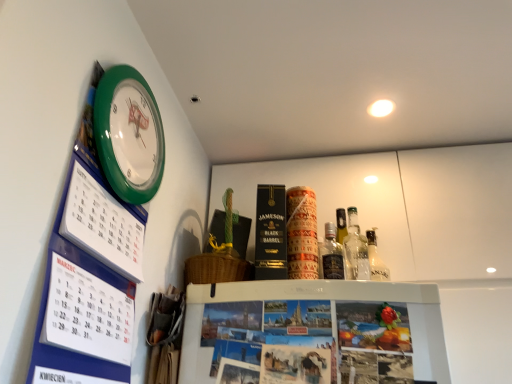
This screenshot has height=384, width=512. Describe the element at coordinates (88, 273) in the screenshot. I see `blue cardboard calendar at upper left` at that location.

In order to click on green plastic wall clock at upper left in this screenshot , I will do `click(129, 134)`.

Image resolution: width=512 pixels, height=384 pixels. I want to click on translucent glass bottle at upper right, so click(331, 255).

Between point (134, 200) and point (320, 272), which one is positioned behind?

The point (320, 272) is farther.

Considering the sizes of objects green plastic wall clock at upper left and translucent glass bottle at upper right in the image provided, who is smaller, green plastic wall clock at upper left or translucent glass bottle at upper right?

Smaller between the two is translucent glass bottle at upper right.

Does green plastic wall clock at upper left have a greater height compared to translucent glass bottle at upper right?

Indeed, green plastic wall clock at upper left has a greater height compared to translucent glass bottle at upper right.

Is green plastic wall clock at upper left in contact with translucent glass bottle at upper right?

No, green plastic wall clock at upper left is not making contact with translucent glass bottle at upper right.

Does point (336, 265) lie in front of point (119, 238)?

No.

Is translucent glass bottle at upper right not close to blue cardboard calendar at upper left?

Actually, translucent glass bottle at upper right and blue cardboard calendar at upper left are a little close together.

Locate an element on the screen. bulletin board that appears on the left of translucent glass bottle at upper right is located at coordinates (88, 273).

Considering the sizes of objects translucent glass bottle at upper right and blue cardboard calendar at upper left in the image provided, who is bigger, translucent glass bottle at upper right or blue cardboard calendar at upper left?

Bigger between the two is blue cardboard calendar at upper left.

Are blue cardboard calendar at upper left and translucent glass bottle at upper right far apart?

No, blue cardboard calendar at upper left is not far from translucent glass bottle at upper right.

Based on their sizes in the image, would you say blue cardboard calendar at upper left is bigger or smaller than translucent glass bottle at upper right?

Clearly, blue cardboard calendar at upper left is larger in size than translucent glass bottle at upper right.

From a real-world perspective, which object rests below the other?

From a 3D spatial view, blue cardboard calendar at upper left is below.

Does translucent glass bottle at upper right appear on the right side of green plastic wall clock at upper left?

Yes.

Is point (337, 245) closer or farther from the camera than point (108, 166)?

Point (337, 245).

From the image's perspective, is green plastic wall clock at upper left above blue cardboard calendar at upper left?

Yes, from the image's perspective, green plastic wall clock at upper left is above blue cardboard calendar at upper left.

This screenshot has width=512, height=384. What are the coordinates of `bulletin board in front of the green plastic wall clock at upper left` in the screenshot? It's located at (88, 273).

From a real-world perspective, which object rests below the other?

In real-world perspective, blue cardboard calendar at upper left is lower.

Between point (142, 190) and point (78, 262), which one is positioned behind?

The point (142, 190) is more distant.

Looking at their sizes, would you say blue cardboard calendar at upper left is wider or thinner than green plastic wall clock at upper left?

Clearly, blue cardboard calendar at upper left has more width compared to green plastic wall clock at upper left.

This screenshot has height=384, width=512. Find the location of `wall clock above the blue cardboard calendar at upper left (from the image's perspective)`. wall clock above the blue cardboard calendar at upper left (from the image's perspective) is located at coordinates (129, 134).

Is blue cardboard calendar at upper left closer to camera compared to green plastic wall clock at upper left?

Yes, blue cardboard calendar at upper left is closer to the camera.

Find the location of `bottle beneath the green plastic wall clock at upper left (from a real-world perspective)`. bottle beneath the green plastic wall clock at upper left (from a real-world perspective) is located at coordinates (331, 255).

Image resolution: width=512 pixels, height=384 pixels. I want to click on bulletin board above the translucent glass bottle at upper right (from the image's perspective), so click(88, 273).

Estimate the real-world distances between objects in this image. Which object is further from green plastic wall clock at upper left, translucent glass bottle at upper right or blue cardboard calendar at upper left?

Based on the image, translucent glass bottle at upper right appears to be further to green plastic wall clock at upper left.

Which object lies nearer to the anchor point blue cardboard calendar at upper left, green plastic wall clock at upper left or translucent glass bottle at upper right?

green plastic wall clock at upper left is closer to blue cardboard calendar at upper left.

From the image, which object appears to be nearer to blue cardboard calendar at upper left, translucent glass bottle at upper right or green plastic wall clock at upper left?

green plastic wall clock at upper left.

From the image, which object appears to be nearer to translucent glass bottle at upper right, blue cardboard calendar at upper left or green plastic wall clock at upper left?

green plastic wall clock at upper left.

From the image, which object appears to be nearer to green plastic wall clock at upper left, blue cardboard calendar at upper left or translucent glass bottle at upper right?

blue cardboard calendar at upper left.

Looking at the image, which one is located further to translucent glass bottle at upper right, green plastic wall clock at upper left or blue cardboard calendar at upper left?

Based on the image, blue cardboard calendar at upper left appears to be further to translucent glass bottle at upper right.

At what (x,y) coordinates should I click in order to perform the action: click on wall clock located between blue cardboard calendar at upper left and translucent glass bottle at upper right in the depth direction. Please return your answer as a coordinate pair (x, y). The image size is (512, 384). Looking at the image, I should click on (129, 134).